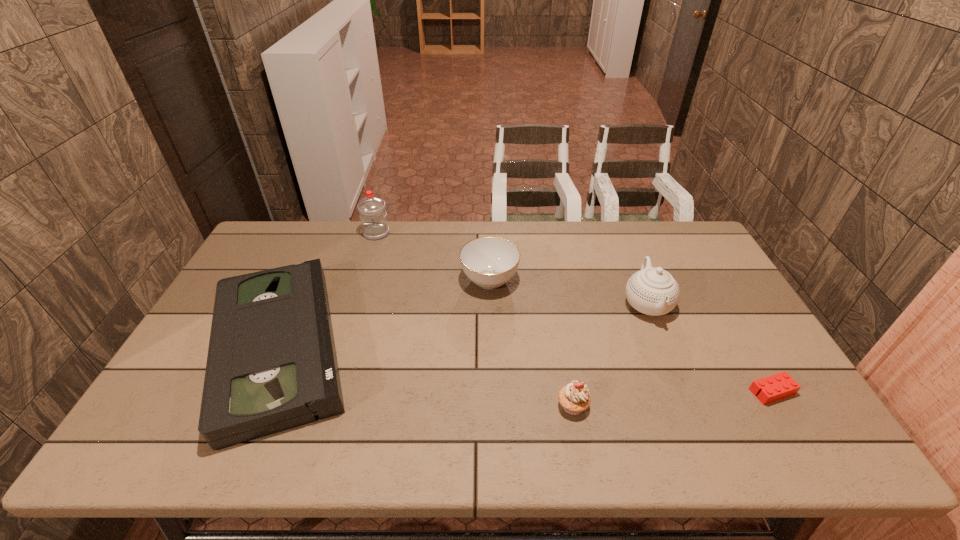
Locate an element on the screen. The height and width of the screenshot is (540, 960). the farthest object is located at coordinates (372, 212).

Locate an element on the screen. Image resolution: width=960 pixels, height=540 pixels. the right chinaware is located at coordinates (653, 291).

Identify the location of the taller chinaware. (653, 291).

Where is `the third object from left to right`? This screenshot has height=540, width=960. the third object from left to right is located at coordinates (489, 262).

Locate an element on the screen. the third tallest object is located at coordinates (489, 262).

Where is `the fourth object from left to right`? the fourth object from left to right is located at coordinates (574, 398).

This screenshot has width=960, height=540. I want to click on the fourth tallest object, so click(574, 398).

Identify the location of the second shortest object. The height and width of the screenshot is (540, 960). (271, 366).

At what (x,y) coordinates should I click in order to perform the action: click on Lego. Please return your answer as a coordinate pair (x, y). Looking at the image, I should click on (781, 385).

Where is `the shortest object`? This screenshot has height=540, width=960. the shortest object is located at coordinates (781, 385).